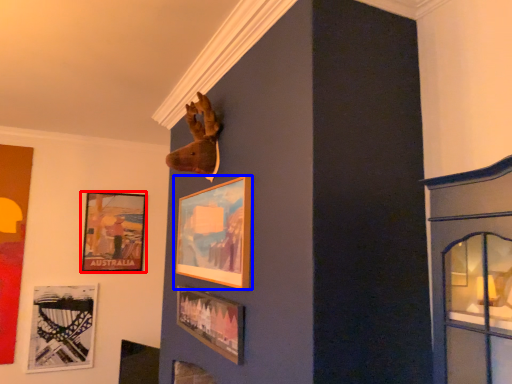
Question: Which object appears farthest to the camera in this image, picture frame (highlighted by a red box) or picture frame (highlighted by a blue box)?

Choices:
 (A) picture frame
 (B) picture frame

Answer: (A)